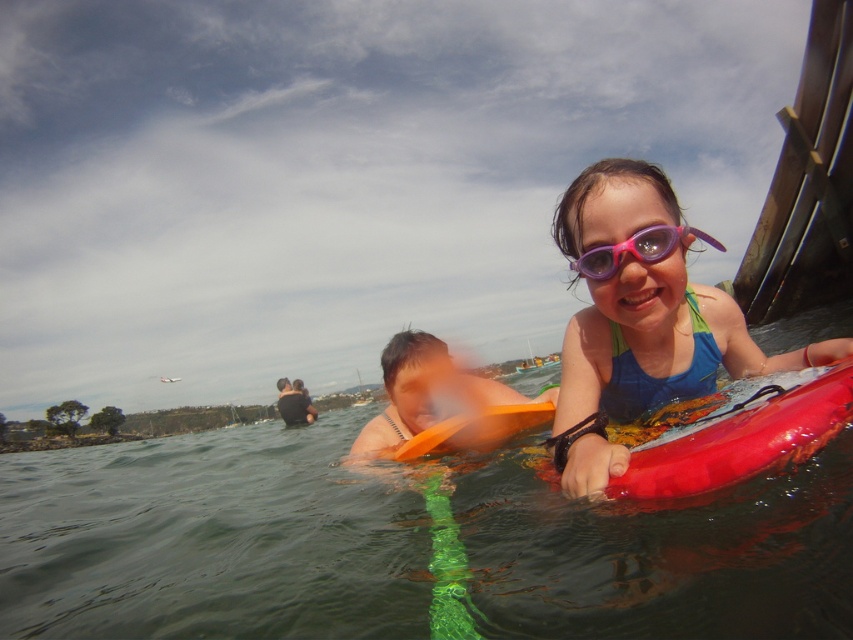
You are a photographer trying to capture a photo of the blue fabric swimsuit at upper right and the orange foam paddle at center. Which object should you focus on first to ensure both are in the frame?

The blue fabric swimsuit at upper right is in front of the orange foam paddle at center, so you should focus on the blue fabric swimsuit at upper right first to ensure both are in the frame.

You are a photographer positioned at the center of the scene. You want to capture a photo of the blue fabric swimsuit at upper right. Based on its location at point 0.500, 0.753, will it appear in the upper half of the photo?

The blue fabric swimsuit at upper right is located at point [641,320]. Since the y coordinate is 0.753 which is above 0.5, it will appear in the upper half of the photo.